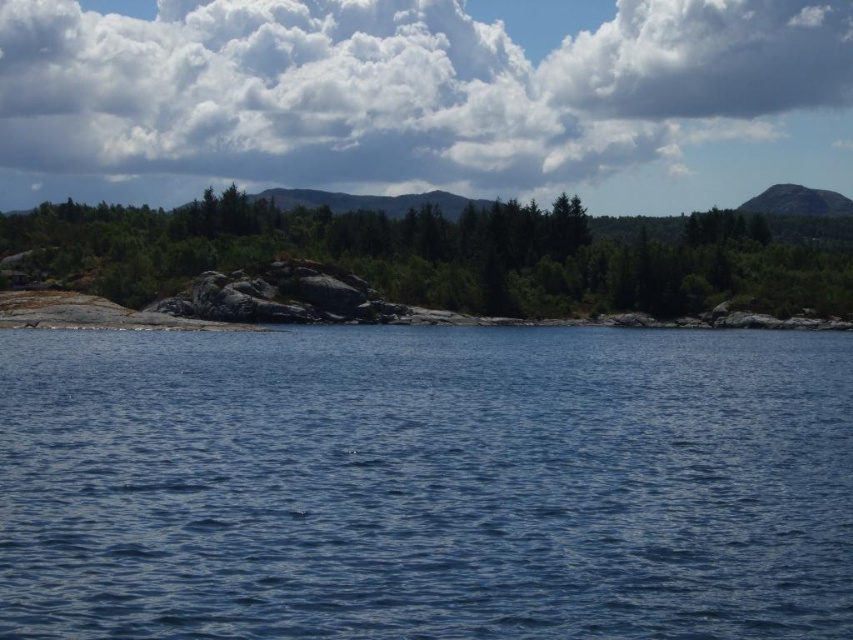
Can you confirm if blue liquid water at center is taller than cloudy sky at upper center?

No.

Between blue liquid water at center and cloudy sky at upper center, which one appears on the right side from the viewer's perspective?

Positioned to the right is blue liquid water at center.

Where is `blue liquid water at center`? The image size is (853, 640). blue liquid water at center is located at coordinates (425, 483).

Does blue liquid water at center appear under gray rock mountain at upper right?

Yes, blue liquid water at center is below gray rock mountain at upper right.

Can you confirm if blue liquid water at center is bigger than gray rock mountain at upper right?

Incorrect, blue liquid water at center is not larger than gray rock mountain at upper right.

Is point (370, 442) positioned after point (776, 204)?

No.

You are a GUI agent. You are given a task and a screenshot of the screen. Output one action in this format:
    pyautogui.click(x=<x>, y=<y>)
    Task: Click on the blue liquid water at center
    The image size is (853, 640).
    Given the screenshot: What is the action you would take?
    pyautogui.click(x=425, y=483)

Is point (160, 268) positioned in front of point (793, 200)?

Yes, it is.

Does green matte tree at center appear on the left side of gray rock mountain at upper right?

Yes, green matte tree at center is to the left of gray rock mountain at upper right.

Locate an element on the screen. The image size is (853, 640). green matte tree at center is located at coordinates (450, 252).

Locate an element on the screen. The height and width of the screenshot is (640, 853). green matte tree at center is located at coordinates (450, 252).